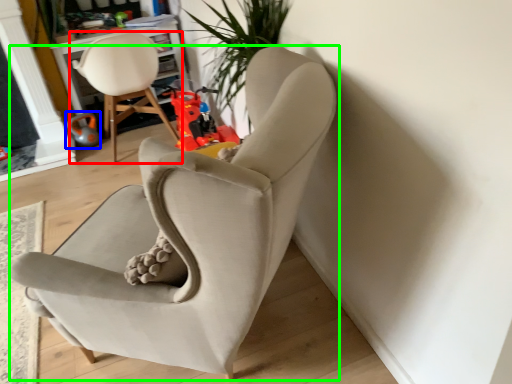
Question: Which object is positioned closest to chair (highlighted by a red box)? Select from toy (highlighted by a blue box) and chair (highlighted by a green box).

Choices:
 (A) toy
 (B) chair

Answer: (A)